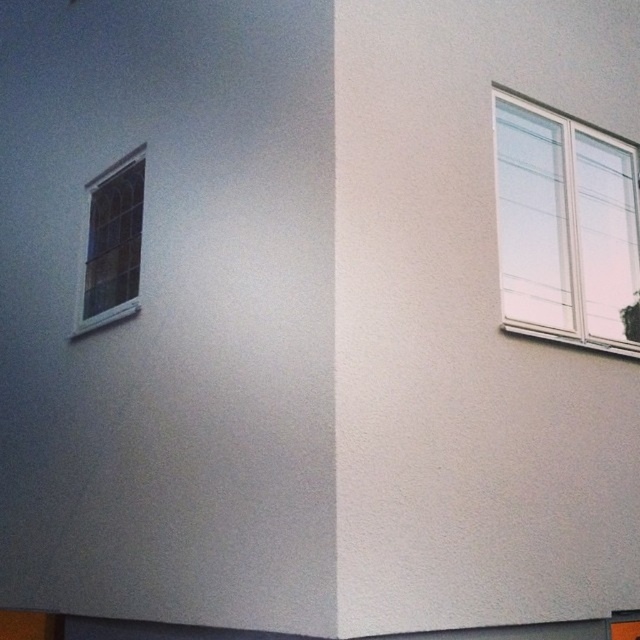
This screenshot has width=640, height=640. What do you see at coordinates (564, 228) in the screenshot? I see `clear glass window at upper right` at bounding box center [564, 228].

Which is more to the left, clear glass window at upper right or clear glass window at upper left?

Positioned to the left is clear glass window at upper left.

Between point (538, 150) and point (86, 212), which one is positioned in front?

Point (538, 150)

This screenshot has width=640, height=640. I want to click on clear glass window at upper right, so click(x=564, y=228).